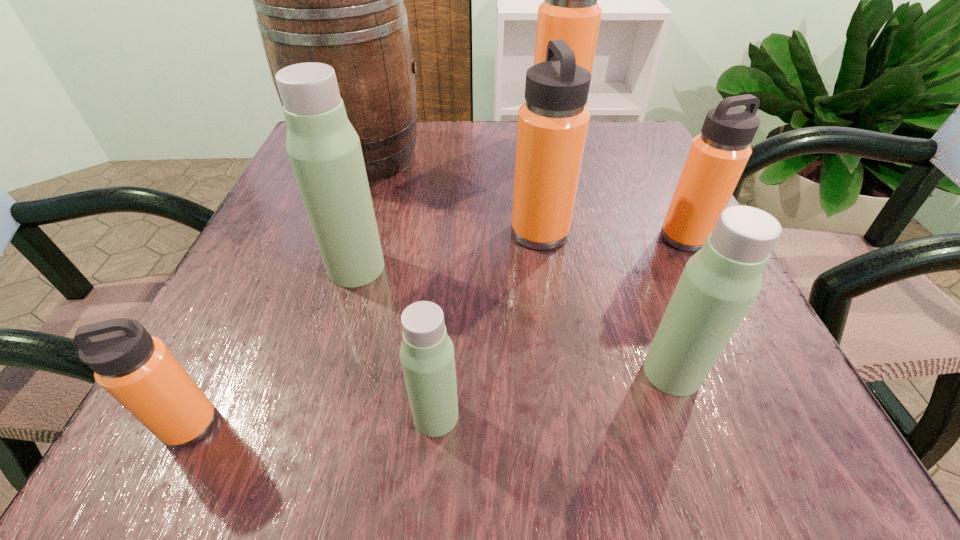
This screenshot has width=960, height=540. In order to click on the third thermos bottle from left to right in this screenshot , I will do `click(427, 356)`.

Locate an element on the screen. This screenshot has height=540, width=960. the leftmost thermos bottle is located at coordinates (138, 370).

Where is `the nearest orange thermos bottle`? the nearest orange thermos bottle is located at coordinates (138, 370).

This screenshot has width=960, height=540. Identify the location of free region located 0.170m on the front of the tallest thermos bottle. 568,194.

The image size is (960, 540). Identify the location of free space located 0.320m on the side of the cider near the bung hole. (576, 157).

This screenshot has height=540, width=960. In order to click on free spot located 0.260m on the front of the third smallest orange thermos bottle in this screenshot , I will do `click(564, 395)`.

Image resolution: width=960 pixels, height=540 pixels. Find the location of `free spot located 0.060m on the front of the farthest light thermos bottle`. free spot located 0.060m on the front of the farthest light thermos bottle is located at coordinates (342, 319).

Image resolution: width=960 pixels, height=540 pixels. I want to click on vacant region located on the left of the rightmost orange thermos bottle, so point(483,238).

This screenshot has height=540, width=960. Identify the location of free space located on the left of the rightmost light thermos bottle. (439, 372).

You are a GUI agent. You are given a task and a screenshot of the screen. Output one action in this format:
    pyautogui.click(x=<x>, y=<y>)
    Task: Click on the free space located 0.230m on the back of the third thermos bottle from left to right
    
    Given the screenshot: What is the action you would take?
    pyautogui.click(x=447, y=265)